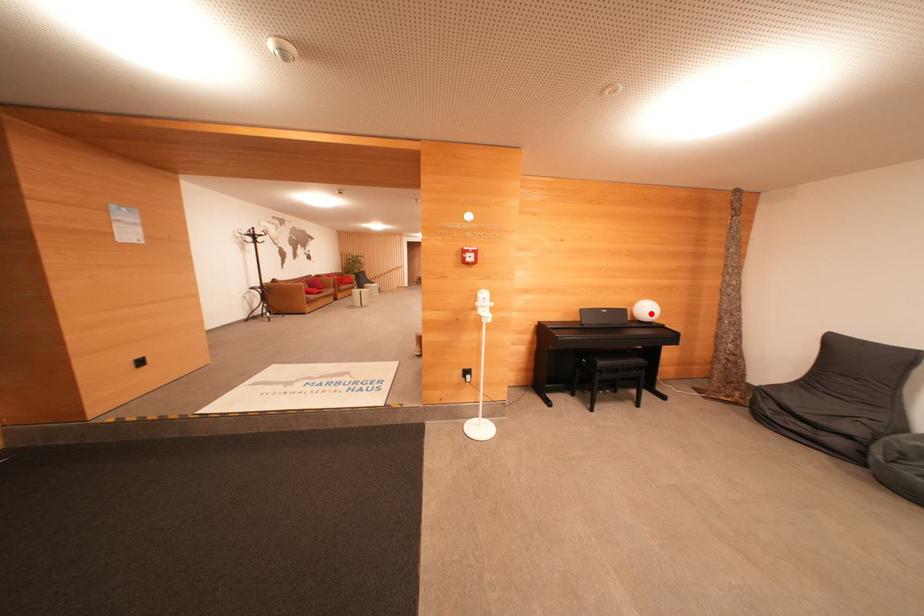
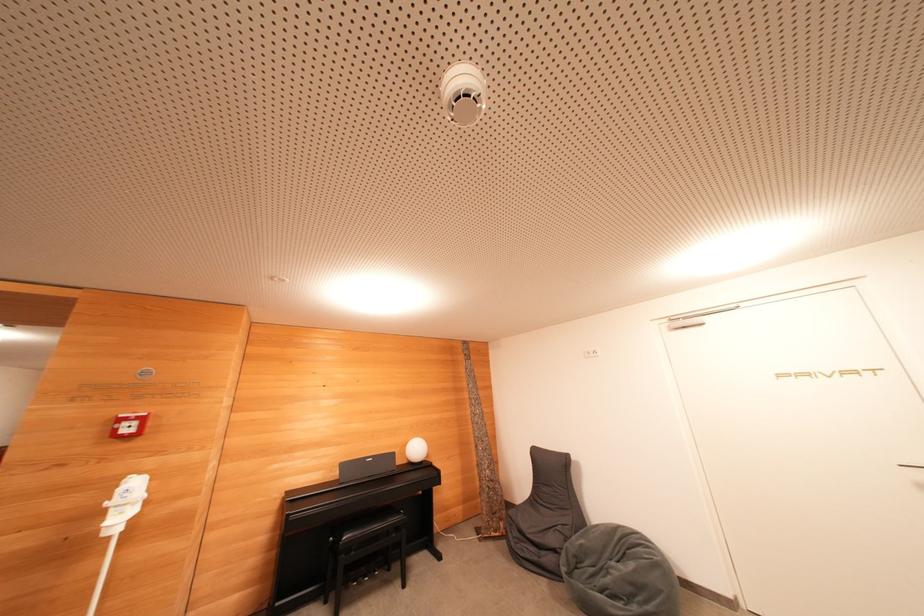
Question: I am providing you with two images of the same scene from different viewpoints. A red point is marked on the first image. Is the red point's position out of view in image 2?

Choices:
 (A) Yes
 (B) No

Answer: (B)